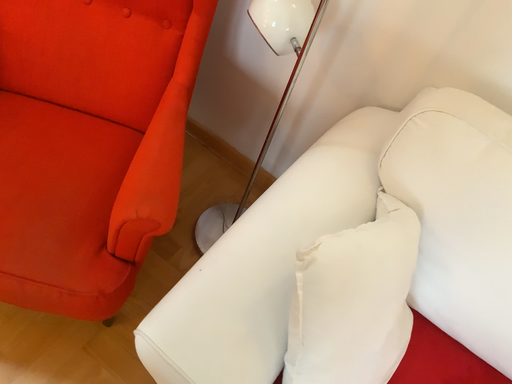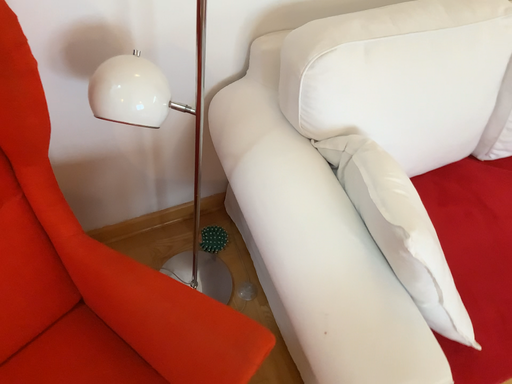
Question: Which way did the camera rotate in the video?

Choices:
 (A) rotated left
 (B) rotated right

Answer: (B)